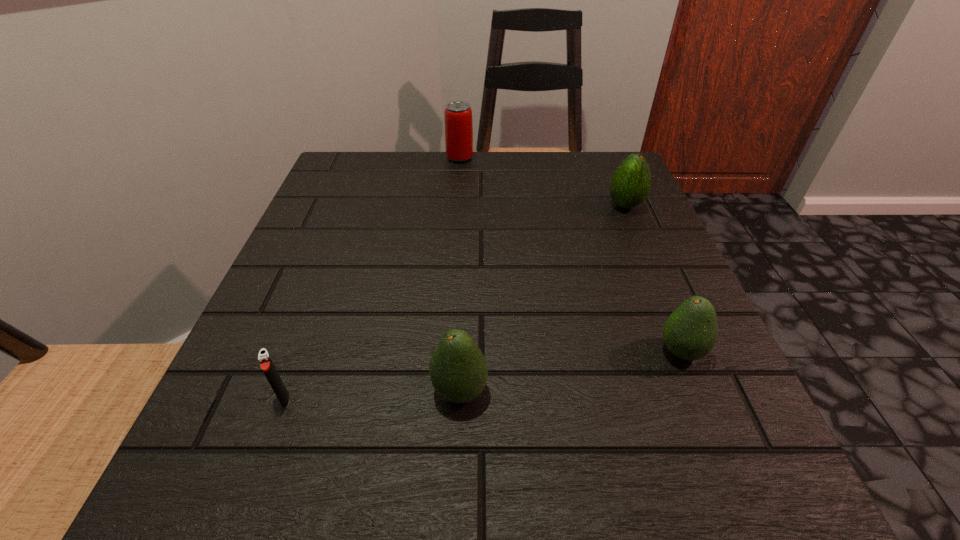
Where is `object at the left edge`? Image resolution: width=960 pixels, height=540 pixels. object at the left edge is located at coordinates (266, 364).

Where is `object at the far right corner`? object at the far right corner is located at coordinates (630, 184).

The image size is (960, 540). I want to click on vacant region at the far edge of the desktop, so click(x=520, y=171).

Locate an element on the screen. This screenshot has width=960, height=540. vacant space at the left edge of the desktop is located at coordinates (283, 260).

Where is `free region at the right edge`? This screenshot has height=540, width=960. free region at the right edge is located at coordinates (653, 255).

At what (x,y) coordinates should I click in order to perform the action: click on free space at the far right corner. Please return your answer as a coordinate pair (x, y). The height and width of the screenshot is (540, 960). Looking at the image, I should click on (588, 195).

In the image, there is a desktop. Identify the location of vacant space at the near right corner. This screenshot has width=960, height=540. (777, 486).

You are a GUI agent. You are given a task and a screenshot of the screen. Output one action in this format:
    pyautogui.click(x=<x>, y=<y>)
    Task: Click on the unoccupied area between the leftmost avocado and the igniter
    The image size is (960, 540).
    Given the screenshot: What is the action you would take?
    pyautogui.click(x=372, y=395)

You are a GUI agent. You are given a task and a screenshot of the screen. Output one action in this format:
    pyautogui.click(x=<x>, y=<y>)
    Task: Click on the free space between the leftmost object and the leftmost avocado
    This screenshot has height=540, width=960.
    Given the screenshot: What is the action you would take?
    pyautogui.click(x=372, y=395)

Locate an element on the screen. empty space between the beer can and the leftmost avocado is located at coordinates (460, 274).